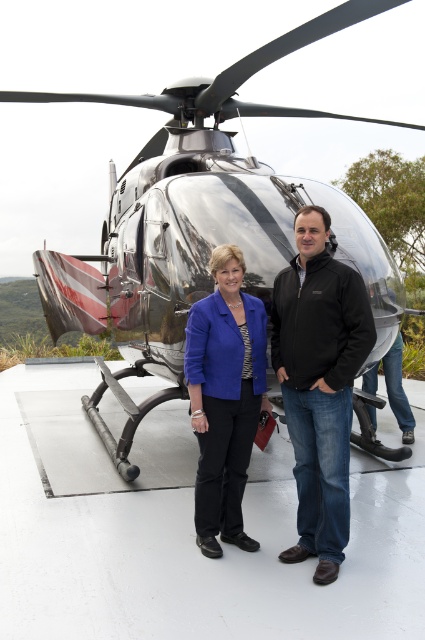
You are a fashion designer observing the two individuals at the helipad. You need to determine which clothing item would require more fabric to produce between the black matte jacket at center and the matte blue blazer at center. Which one would it be?

The black matte jacket at center has a larger size compared to the matte blue blazer at center, so it would require more fabric to produce.